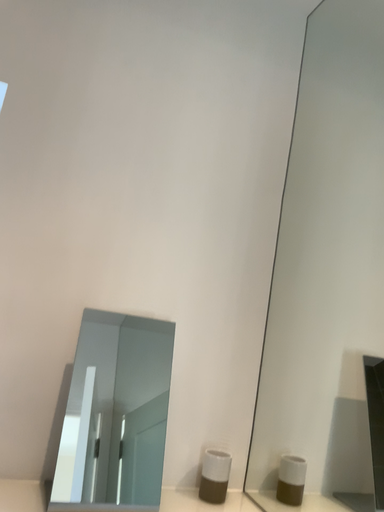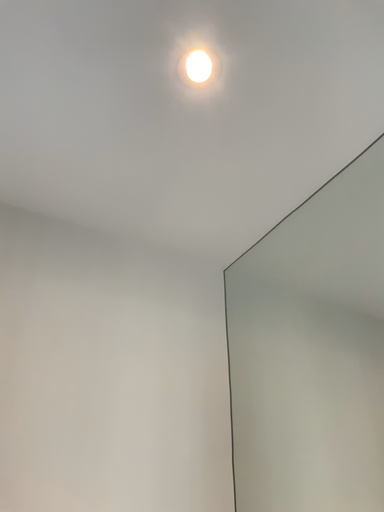
Question: Which way did the camera rotate in the video?

Choices:
 (A) rotated downward
 (B) rotated upward

Answer: (B)